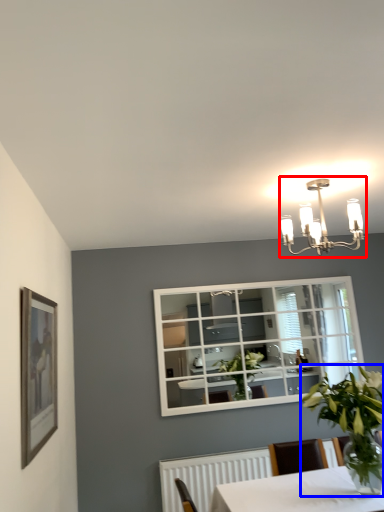
Question: Which object is further to the camera taking this photo, lamp (highlighted by a red box) or houseplant (highlighted by a blue box)?

Choices:
 (A) lamp
 (B) houseplant

Answer: (A)